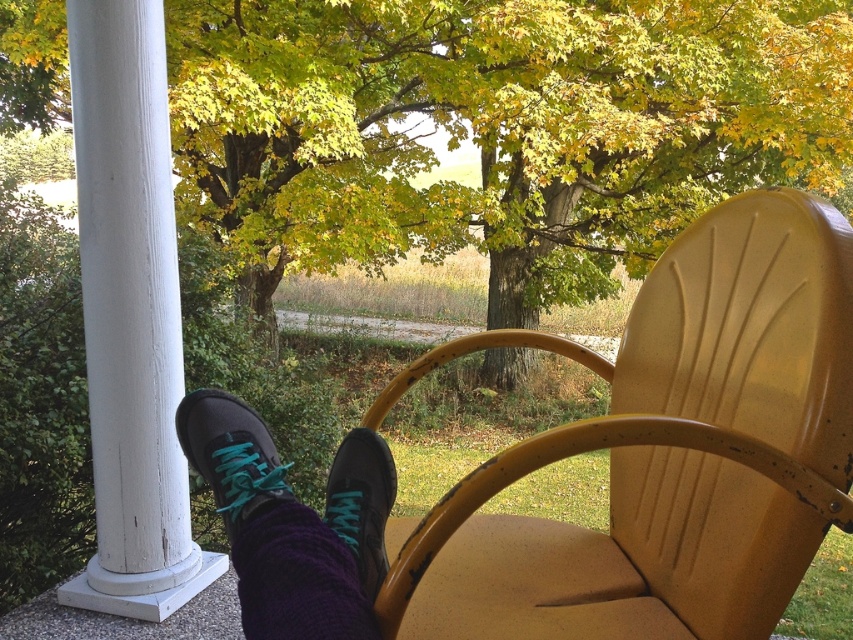
You are standing on the porch and want to sit down on the yellow metal chair with your feet resting on its armrest. However, you notice a point marked at coordinates (664, 452). What object is located at that point?

The point at coordinates (664, 452) indicates the location of the matte yellow plastic chair at center.

You are sitting on the porch and want to place a small potted plant between the white painted wood column at left and the matte black sneaker at lower left. Based on their sizes, which object should the plant be closer to?

The white painted wood column at left is larger than the matte black sneaker at lower left, so the plant should be placed closer to the white painted wood column at left to maintain proportion.

You are a photographer trying to capture both the matte black shoes at lower left and the purple knitted sock at lower center in a single closeup shot. Since the camera can only focus on one object at a time, which object should you choose to ensure the smaller one is in focus?

The purple knitted sock at lower center is smaller than the matte black shoes at lower left. To ensure the smaller object is in focus, you should focus on the purple knitted sock at lower center.